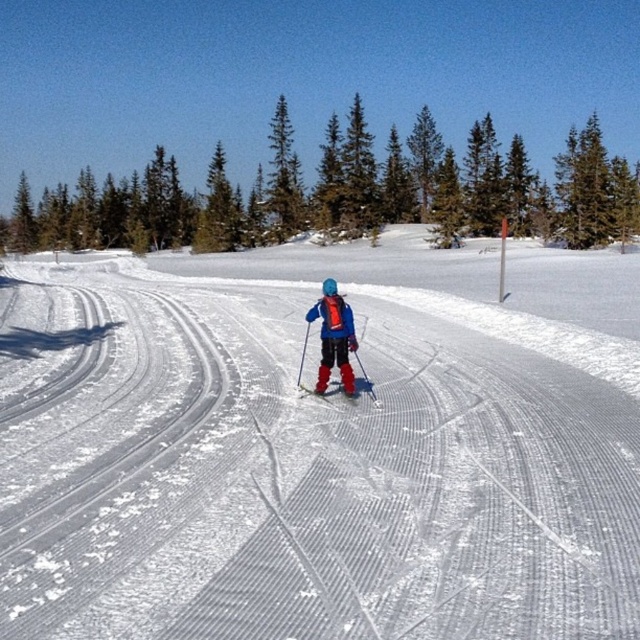
Is point (314, 316) farther from camera compared to point (342, 396)?

No, (314, 316) is in front of (342, 396).

I want to click on matte blue ski suit at center, so click(333, 337).

Does green coniferous trees at upper center have a greater width compared to matte red ski at center?

Correct, the width of green coniferous trees at upper center exceeds that of matte red ski at center.

Who is more forward, [337,116] or [336,381]?

Positioned in front is point [336,381].

Identify the location of green coniferous trees at upper center. (342, 195).

Does point (248, 556) lie behind point (410, 184)?

No, it is in front of (410, 184).

Can you confirm if white textured snow at center is bigger than green coniferous trees at upper center?

No, white textured snow at center is not bigger than green coniferous trees at upper center.

The width and height of the screenshot is (640, 640). Identify the location of white textured snow at center. (317, 448).